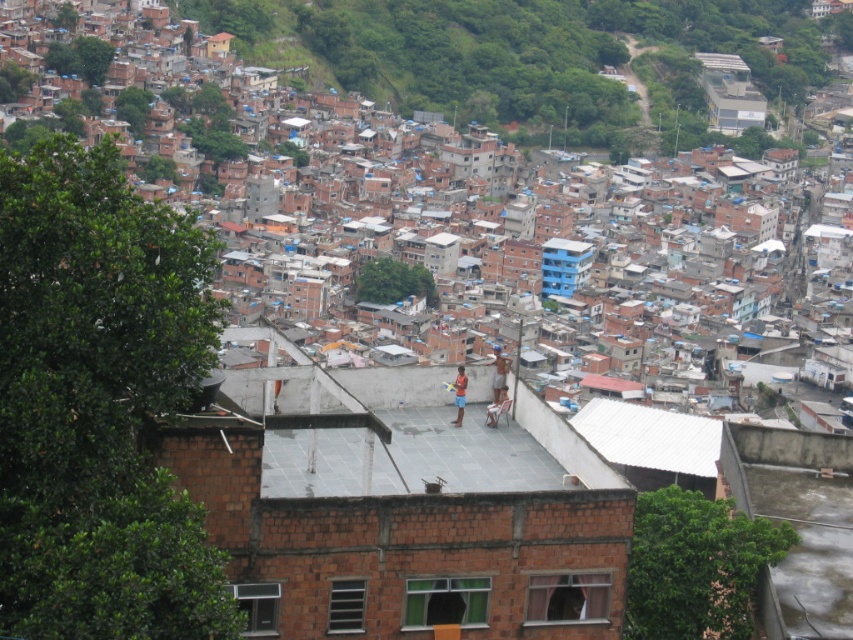
Is brown brick houses at upper left bigger than white corrugated metal roof at center?

Yes.

Can you confirm if brown brick houses at upper left is shorter than white corrugated metal roof at center?

No.

Is point (556, 131) positioned in front of point (595, 435)?

No, (556, 131) is behind (595, 435).

This screenshot has height=640, width=853. What are the coordinates of `brown brick houses at upper left` in the screenshot? It's located at (534, 54).